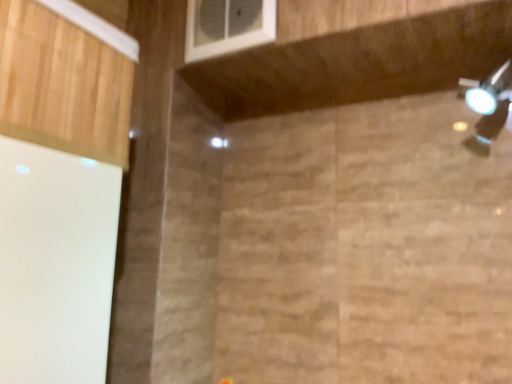
Measure the distance between white plastic window at upper center and camera.

white plastic window at upper center and camera are 76.95 centimeters apart.

This screenshot has height=384, width=512. What do you see at coordinates (227, 26) in the screenshot?
I see `white plastic window at upper center` at bounding box center [227, 26].

At what (x,y) coordinates should I click in order to perform the action: click on white plastic window at upper center. Please return your answer as a coordinate pair (x, y). This screenshot has height=384, width=512. Looking at the image, I should click on (227, 26).

Where is `white plastic window at upper center`? This screenshot has width=512, height=384. white plastic window at upper center is located at coordinates (227, 26).